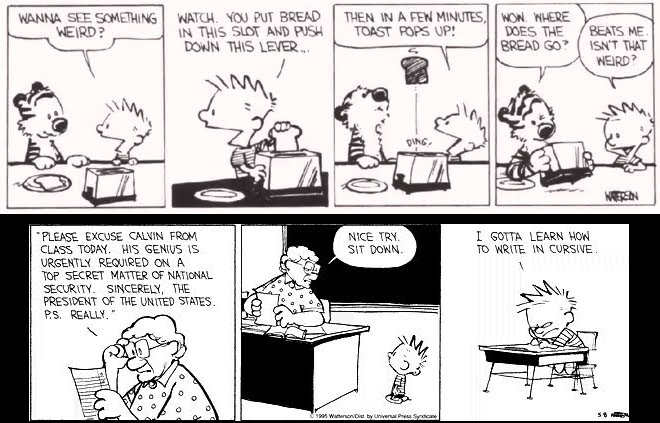
Locate an element on the screen. toaster is located at coordinates tap(116, 186), tap(288, 174), tap(426, 171), tap(563, 168).